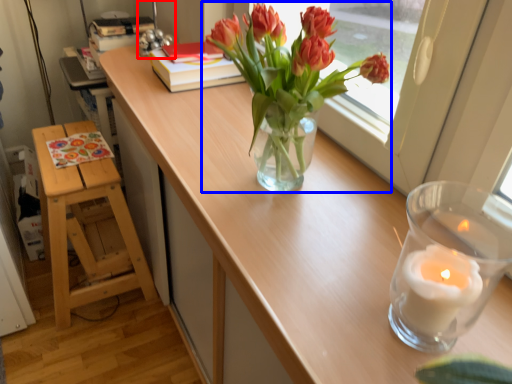
Question: Which of the following is the farthest to the observer, table lamp (highlighted by a red box) or houseplant (highlighted by a blue box)?

Choices:
 (A) table lamp
 (B) houseplant

Answer: (A)